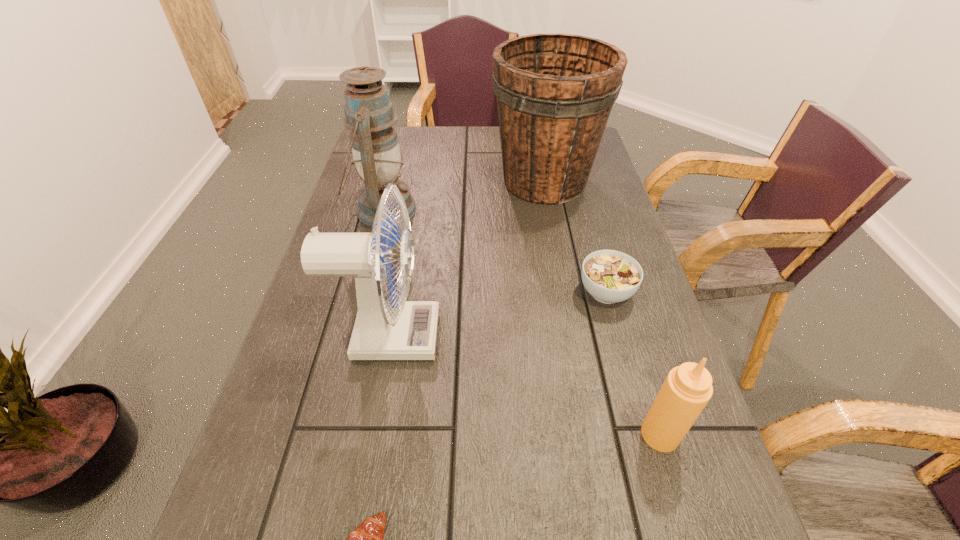
Identify the location of oil lamp. Image resolution: width=960 pixels, height=540 pixels. (369, 113).

Find the location of a particular element. bucket is located at coordinates (555, 92).

Find the location of a particular element. This screenshot has height=540, width=960. fan is located at coordinates (384, 330).

Find the location of a particular element. the second nearest object is located at coordinates (687, 389).

I want to click on condiment, so click(x=687, y=389).

You are a GUI agent. You are given a task and a screenshot of the screen. Output one action in this format:
    pyautogui.click(x=<x>, y=<y>)
    Task: Click on the soup bowl
    This screenshot has height=540, width=960.
    Given the screenshot: What is the action you would take?
    pyautogui.click(x=610, y=276)

Find the location of `vacant region located on the front of the oil lamp`. vacant region located on the front of the oil lamp is located at coordinates (356, 314).

I want to click on blank space located on the left of the bucket, so click(x=408, y=181).

Find the location of a particular element. This screenshot has height=540, width=960. free space located 0.050m on the front-facing side of the fan is located at coordinates (462, 336).

Locate an element on the screen. Image resolution: width=960 pixels, height=540 pixels. vacant space positioned 0.300m on the left of the second nearest object is located at coordinates (465, 434).